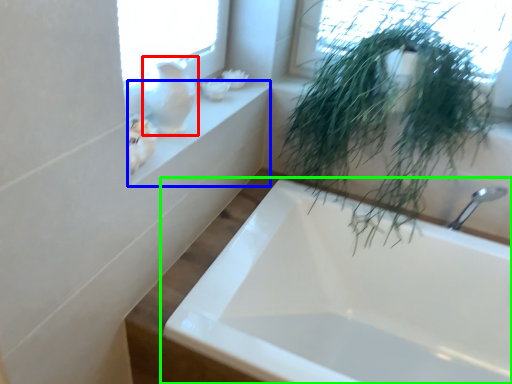
Question: Considering the real-world distances, which object is farthest from glass vase (highlighted by a red box)? window sill (highlighted by a blue box) or bathtub (highlighted by a green box)?

Choices:
 (A) window sill
 (B) bathtub

Answer: (B)